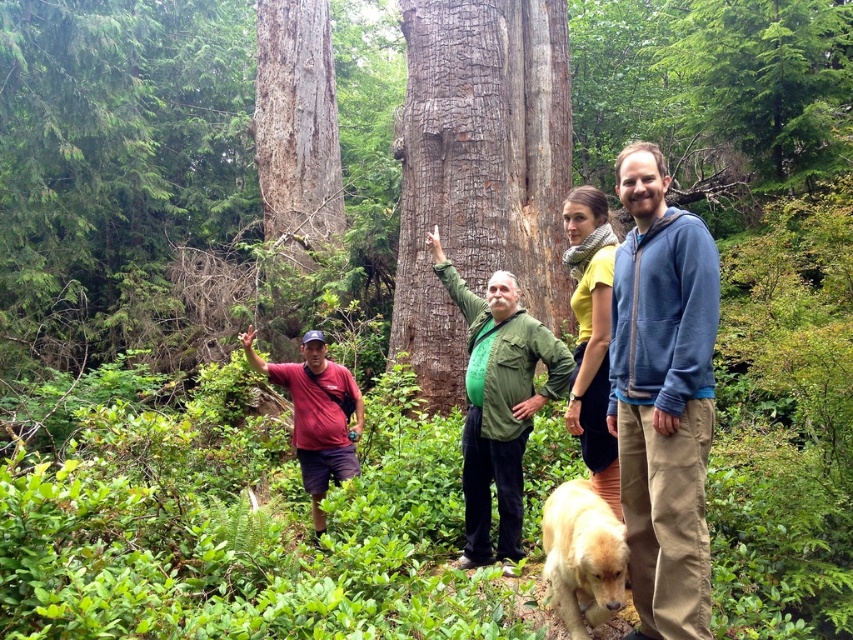
Question: Which point is closer to the camera taking this photo?

Choices:
 (A) (415, 339)
 (B) (317, 394)
 (C) (567, 576)
 (D) (642, 556)

Answer: (D)

Question: Is smooth brown bark at center below golden fur dog at lower center?

Choices:
 (A) yes
 (B) no

Answer: (B)

Question: Which object is the farthest from the smooth brown bark at center?

Choices:
 (A) blue fleece jacket at right
 (B) green matte jacket at center
 (C) matte red t-shirt at lower left

Answer: (A)

Question: Does golden fur dog at lower center appear under matte red t-shirt at lower left?

Choices:
 (A) yes
 (B) no

Answer: (A)

Question: Which object is the closest to the golden fur dog at lower center?

Choices:
 (A) green matte jacket at center
 (B) smooth brown bark at center
 (C) matte red t-shirt at lower left

Answer: (A)

Question: Does yellow matte scarf at upper center have a smaller size compared to matte red t-shirt at lower left?

Choices:
 (A) yes
 (B) no

Answer: (A)